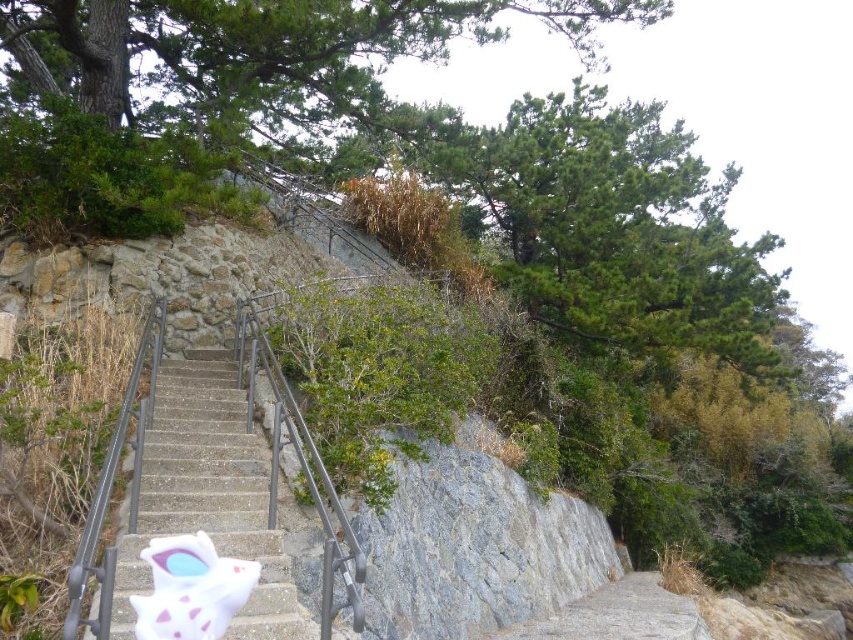
Question: Does green textured tree at upper center appear on the left side of green leafy tree at upper center?

Choices:
 (A) yes
 (B) no

Answer: (A)

Question: Which object is positioned farthest from the green leafy tree at upper center?

Choices:
 (A) concrete stairs at center
 (B) green textured tree at upper center

Answer: (A)

Question: Does green leafy tree at upper center appear on the left side of concrete stairs at center?

Choices:
 (A) no
 (B) yes

Answer: (A)

Question: Which point is closer to the camera?

Choices:
 (A) (312, 99)
 (B) (267, 541)

Answer: (B)

Question: Can you confirm if green textured tree at upper center is thinner than concrete stairs at center?

Choices:
 (A) no
 (B) yes

Answer: (A)

Question: Estimate the real-world distances between objects in this image. Which object is closer to the green leafy tree at upper center?

Choices:
 (A) concrete stairs at center
 (B) green textured tree at upper center

Answer: (B)